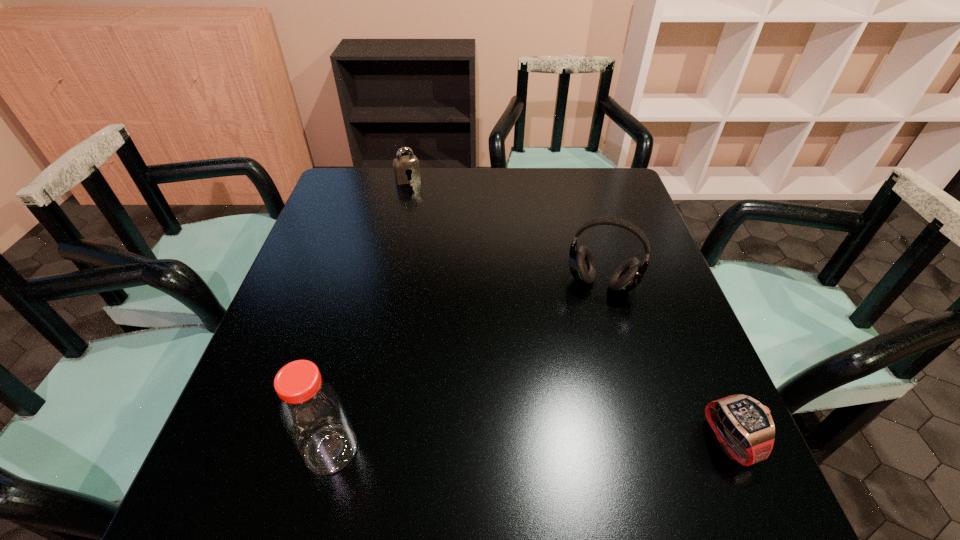
The height and width of the screenshot is (540, 960). I want to click on headset located in the right edge section of the desktop, so click(x=628, y=275).

The image size is (960, 540). Identify the location of object located at the near left corner. (312, 412).

In order to click on object located at the near right corner in this screenshot , I will do `click(744, 427)`.

I want to click on vacant area at the far edge, so click(473, 176).

At what (x,y) coordinates should I click in order to perform the action: click on vacant point at the near edge. Please return your answer as a coordinate pair (x, y). Looking at the image, I should click on (517, 417).

The height and width of the screenshot is (540, 960). What are the coordinates of `free spot at the right edge of the desktop` in the screenshot? It's located at (616, 214).

You are a GUI agent. You are given a task and a screenshot of the screen. Output one action in this format:
    pyautogui.click(x=<x>, y=<y>)
    Task: Click on the vacant space at the far left corner of the desktop
    
    Given the screenshot: What is the action you would take?
    pyautogui.click(x=376, y=191)

Where is `vacant area at the far right corner of the desktop`? vacant area at the far right corner of the desktop is located at coordinates (588, 205).

The height and width of the screenshot is (540, 960). I want to click on unoccupied position between the third object from left to right and the watch, so click(x=665, y=362).

Identify the location of vacant space in between the bottle and the third shortest object. (467, 366).